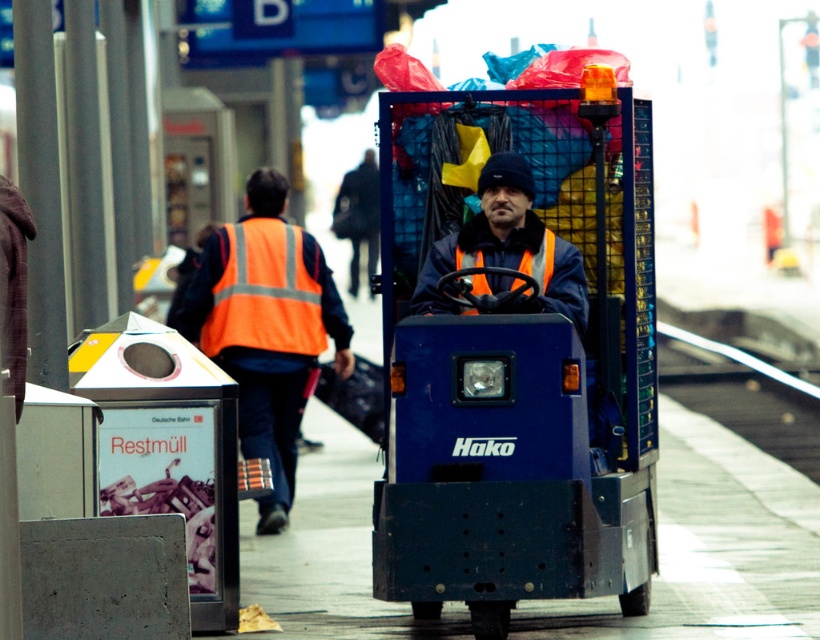
Does metal at center come in front of orange reflective safety vest at center?

No.

Between metal at center and orange reflective safety vest at center, which one appears on the left side from the viewer's perspective?

Positioned to the left is orange reflective safety vest at center.

Is point (814, 417) farther from viewer compared to point (550, 266)?

Yes, it is.

The height and width of the screenshot is (640, 820). Find the location of `metal at center`. metal at center is located at coordinates (743, 401).

Does orange reflective vest at center lie in front of orange reflective safety vest at center?

No, it is not.

Which is in front, point (477, 285) or point (459, 257)?

Point (477, 285) is more forward.

Does point (486, 221) come closer to viewer compared to point (522, 272)?

No.

Locate an element on the screen. orange reflective vest at center is located at coordinates (508, 244).

Is orange reflective vest at left positioned before orange reflective safety vest at center?

That is False.

Locate an element on the screen. This screenshot has width=820, height=640. orange reflective vest at left is located at coordinates (266, 326).